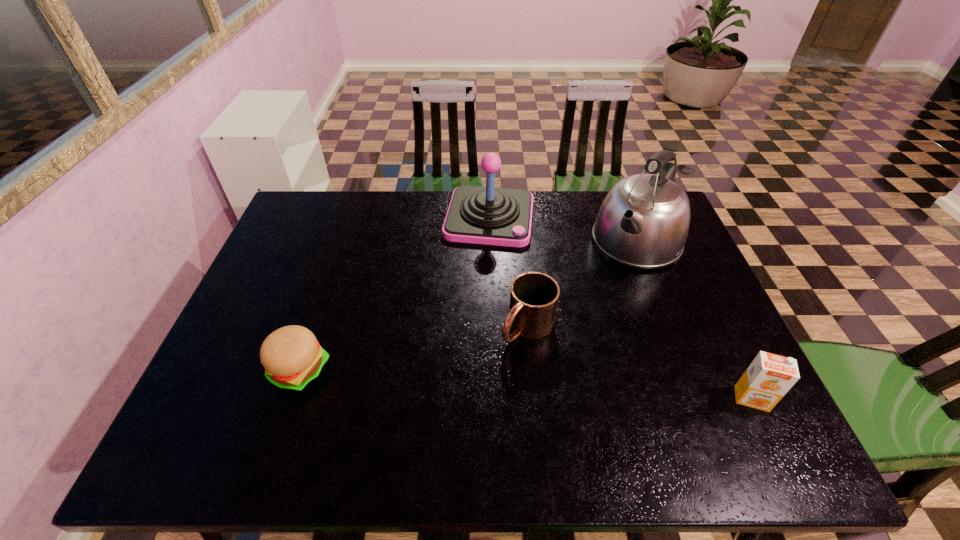
Image resolution: width=960 pixels, height=540 pixels. What are the coordinates of `vacant space located 0.150m forward from the base of the fourth shortest object` in the screenshot? It's located at (477, 282).

The height and width of the screenshot is (540, 960). What are the coordinates of `free spot located 0.170m forward from the base of the fourth shortest object` in the screenshot? It's located at (476, 287).

The height and width of the screenshot is (540, 960). Identify the location of vacant point located 0.120m forward from the base of the fourth shortest object. (479, 274).

You are a GUI agent. You are given a task and a screenshot of the screen. Output one action in this format:
    pyautogui.click(x=<x>, y=<y>)
    Task: Click on the free space located on the side of the mug with the handle
    Image resolution: width=960 pixels, height=540 pixels.
    Given the screenshot: What is the action you would take?
    pyautogui.click(x=471, y=385)

I want to click on vacant area situated 0.060m on the side of the mug with the handle, so coord(495,360).

Where is `free region located on the side of the mug with the handle`? free region located on the side of the mug with the handle is located at coordinates (447, 409).

At what (x,y) coordinates should I click in order to perform the action: click on kettle at the far edge. Please return your answer as a coordinate pair (x, y). This screenshot has height=540, width=960. Looking at the image, I should click on (643, 222).

Find the location of a particular element. joystick located at the far edge is located at coordinates (488, 215).

I want to click on hamburger that is at the near edge, so click(292, 357).

The height and width of the screenshot is (540, 960). Identify the location of orange juice at the near edge. (769, 377).